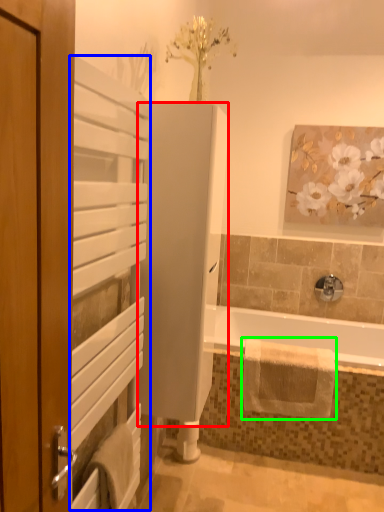
Question: Based on their relative distances, which object is farther from screen door (highlighted by a red box)? Choose from screen door (highlighted by a blue box) and bath towel (highlighted by a green box).

Choices:
 (A) screen door
 (B) bath towel

Answer: (B)